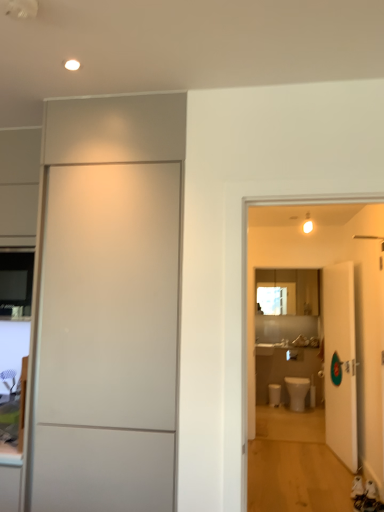
Question: Is white glossy toilet bowl at lower center in front of or behind white matte door at left, which is the 2th door from back to front, in the image?

Choices:
 (A) front
 (B) behind

Answer: (B)

Question: Considering the positions of white glossy toilet bowl at lower center and white matte door at left, arranged as the 2th door when viewed from the right, in the image, is white glossy toilet bowl at lower center bigger or smaller than white matte door at left, arranged as the 2th door when viewed from the right,?

Choices:
 (A) big
 (B) small

Answer: (B)

Question: Estimate the real-world distances between objects in this image. Which object is farther from the white glossy door at right, positioned as the second door in left-to-right order?

Choices:
 (A) white matte door at left, which is the 2th door from back to front
 (B) white glossy toilet at center
 (C) white glossy toilet bowl at lower center

Answer: (A)

Question: Estimate the real-world distances between objects in this image. Which object is closer to the white matte door at left, which is the 2th door from back to front?

Choices:
 (A) white glossy toilet at center
 (B) white glossy door at right, positioned as the first door in back-to-front order
 (C) white glossy toilet bowl at lower center

Answer: (B)